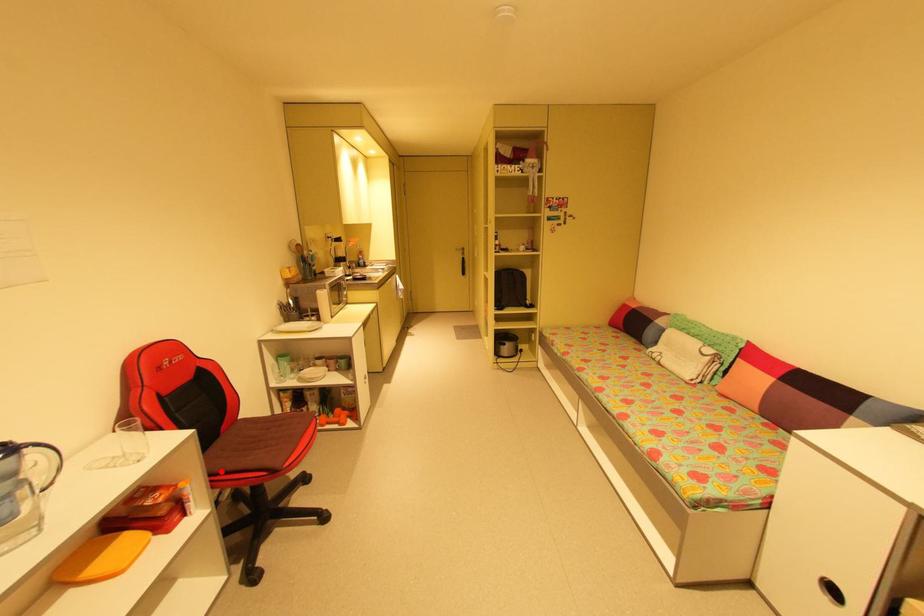
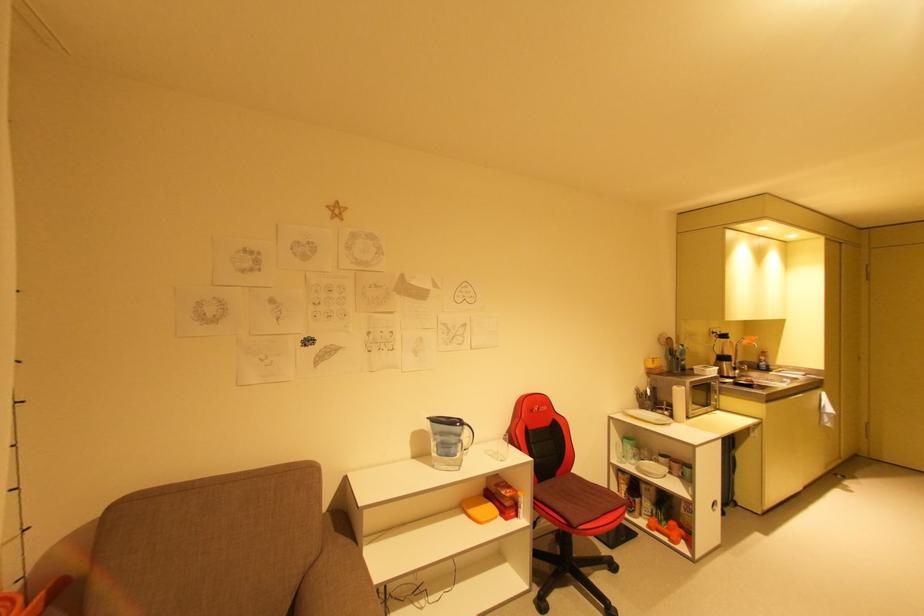
Question: I am providing you with two images of the same scene from different viewpoints. Image1 has a red point marked. In image2, the corresponding 3D location appears at what relative position? Reply with the corresponding letter.

Choices:
 (A) Closer
 (B) Farther

Answer: (B)